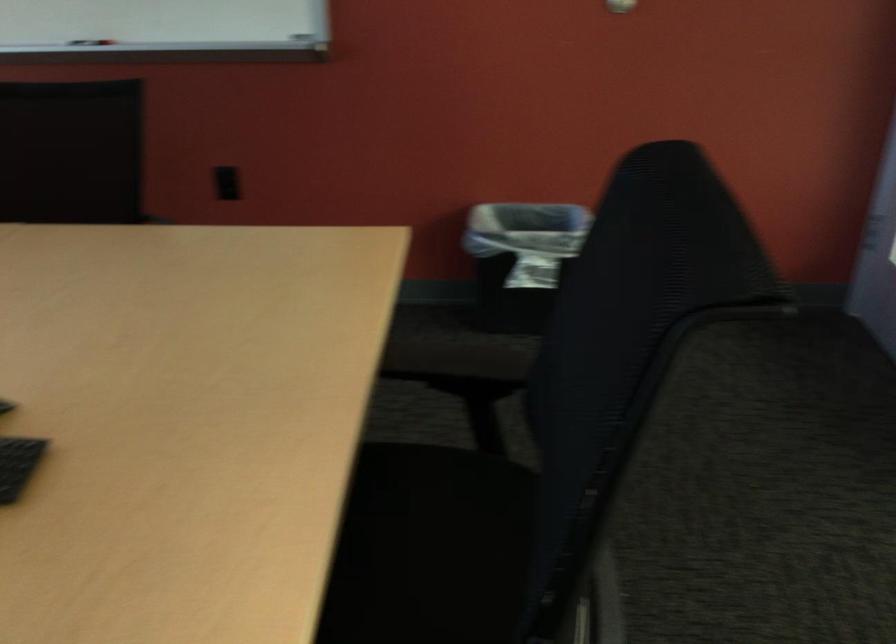
Image resolution: width=896 pixels, height=644 pixels. I want to click on black chair armrest, so click(x=457, y=361).